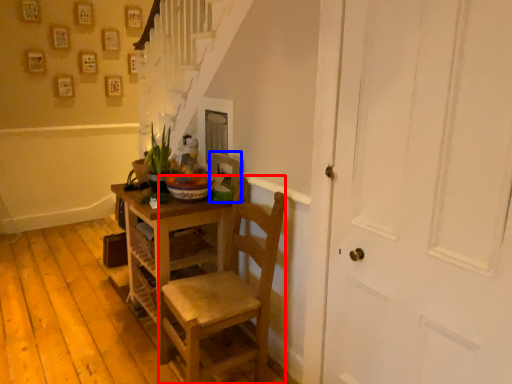
Question: Which of the following is the farthest to the observer, chair (highlighted by a red box) or picture frame (highlighted by a blue box)?

Choices:
 (A) chair
 (B) picture frame

Answer: (B)